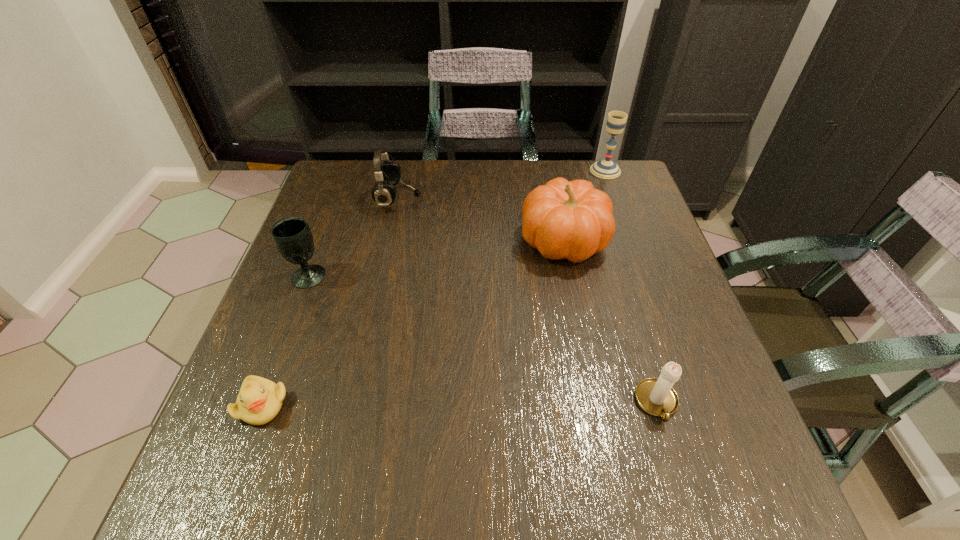
Identify which object is the second closest to the pumpkin. Please provide its 2D coordinates. Your answer should be formatted as a tuple, i.e. [(x, y)], where the tuple contains the x and y coordinates of a point satisfying the conditions above.

[(387, 174)]

Locate an element on the screen. This screenshot has width=960, height=540. object that ranks as the second closest to the nearer chalice is located at coordinates (259, 400).

This screenshot has height=540, width=960. I want to click on vacant region that satisfies the following two spatial constraints: 1. with the microphone on the side of the headset; 2. on the beak of the duckling, so click(x=353, y=405).

I want to click on free region that satisfies the following two spatial constraints: 1. with the microphone on the side of the pumpkin; 2. on the right side of the third object from left to right, so click(389, 240).